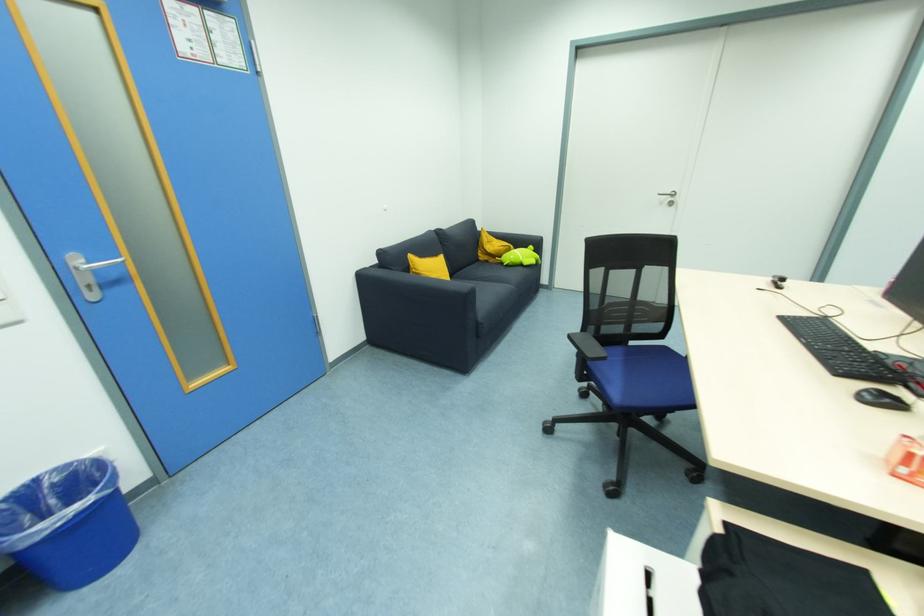
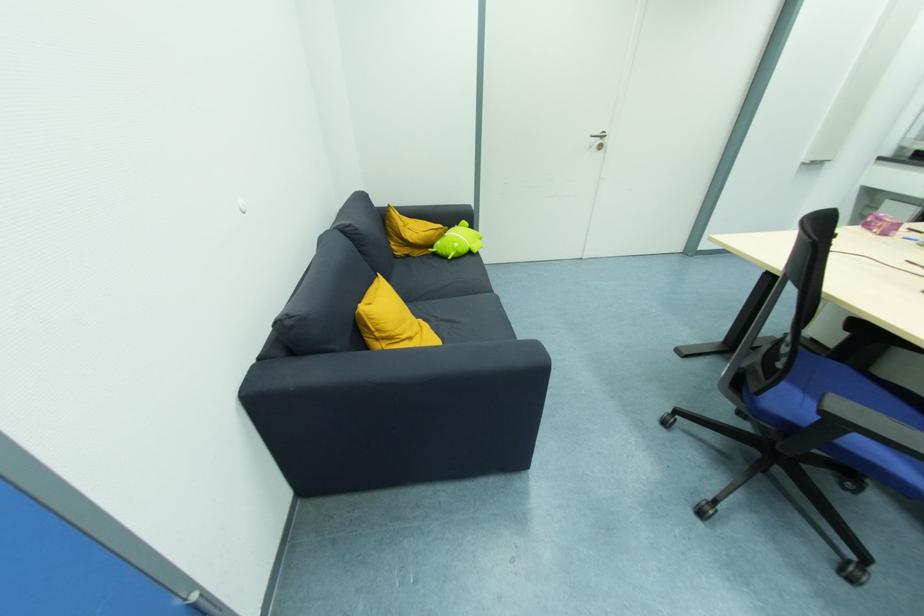
In the second image, find the point that corresponds to (415,262) in the first image.

(372, 321)